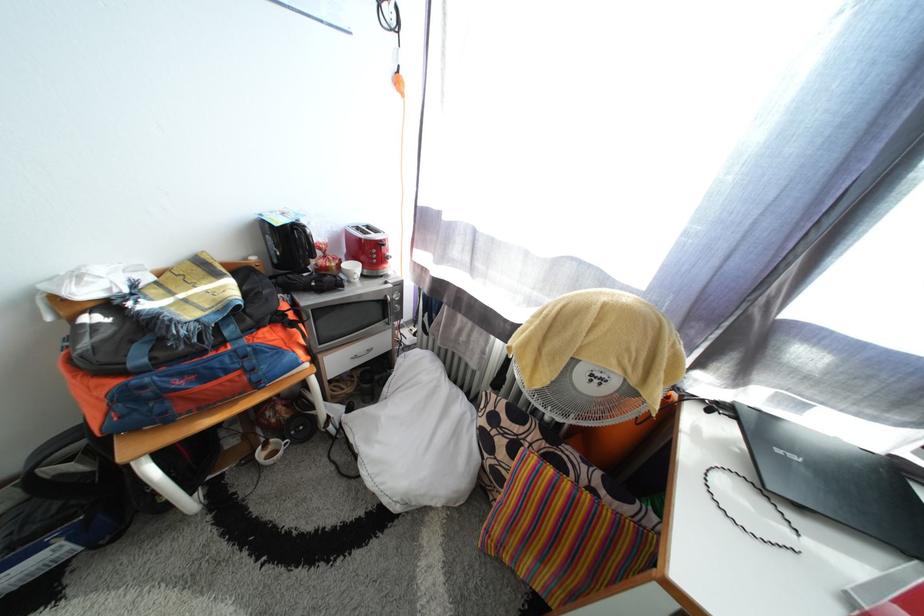
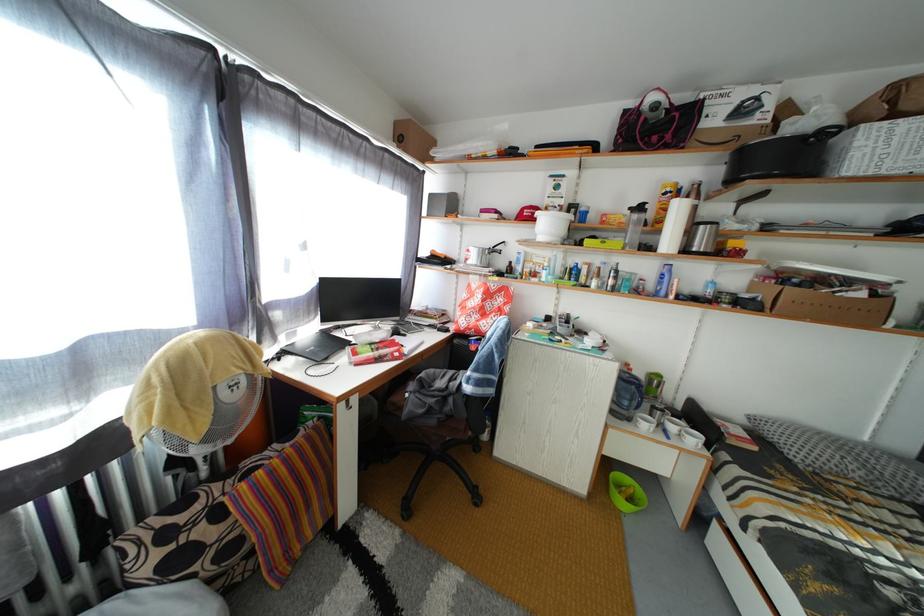
Based on the continuous images, in which direction is the camera rotating?

The camera rotated toward right-down.